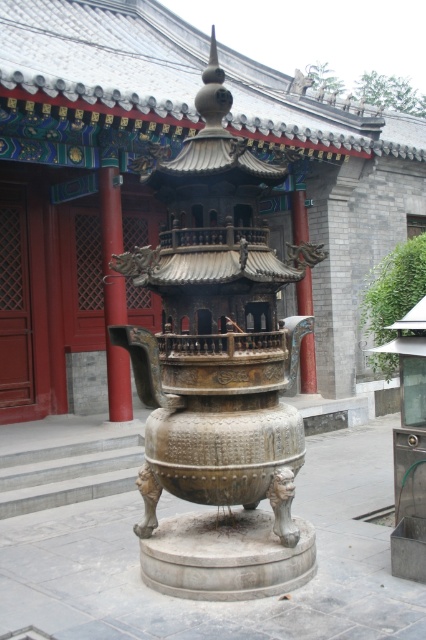
You are an architect inspecting the traditional Chinese architectural scene. You notice two pillars at the center of the image. Which pillar is taller? The smooth red pillar at center or the bronze textured pillar at center?

The smooth red pillar at center is taller than the bronze textured pillar at center.

You are standing at the entrance of the building and want to walk straight ahead towards the smooth red pillar at center. What coordinate point should you aim for?

You should aim for the coordinate point at (114,291) to reach the smooth red pillar at center.

In the scene shown: You are standing in front of the traditional Chinese architectural scene described. You want to place a 10 feet long decorative banner between the smooth red pillar at center and another structure. Is there enough space for the banner if you hang it horizontally?

The smooth red pillar at center is 33.87 feet away from the viewer. However, the distance to the other structure isn not specified in the provided information. Without knowing the distance to the second structure, it is impossible to determine if the 10 feet banner would fit. More information is needed about the location of the second point for the banner.